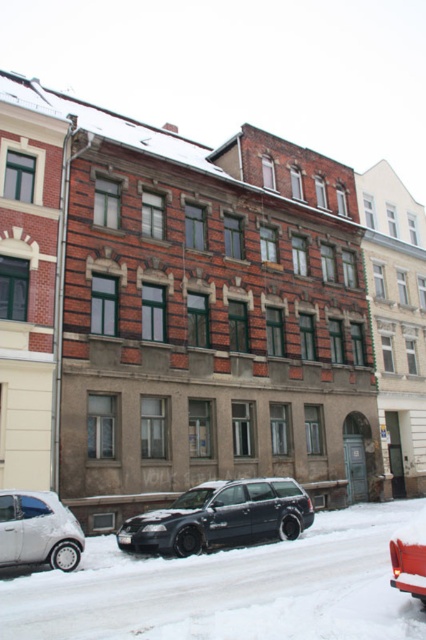
Does shiny black station wagon at center have a lesser width compared to silver metallic car at lower left?

In fact, shiny black station wagon at center might be wider than silver metallic car at lower left.

Is shiny black station wagon at center below silver metallic car at lower left?

Yes, shiny black station wagon at center is below silver metallic car at lower left.

Identify the location of shiny black station wagon at center. (221, 516).

This screenshot has width=426, height=640. What are the coordinates of `shiny black station wagon at center` in the screenshot? It's located at click(221, 516).

Can you confirm if white powdery snow at center is wider than metallic silver car at lower right?

Correct, the width of white powdery snow at center exceeds that of metallic silver car at lower right.

Does white powdery snow at center have a larger size compared to metallic silver car at lower right?

Yes.

Describe the element at coordinates (227, 589) in the screenshot. This screenshot has width=426, height=640. I see `white powdery snow at center` at that location.

At what (x,y) coordinates should I click in order to perform the action: click on white powdery snow at center. Please return your answer as a coordinate pair (x, y). Looking at the image, I should click on (227, 589).

Is point (250, 586) positioned in front of point (14, 506)?

Yes, it is.

Does white powdery snow at center appear on the right side of silver metallic car at lower left?

Yes, white powdery snow at center is to the right of silver metallic car at lower left.

The width and height of the screenshot is (426, 640). I want to click on white powdery snow at center, so click(227, 589).

This screenshot has width=426, height=640. I want to click on white powdery snow at center, so click(227, 589).